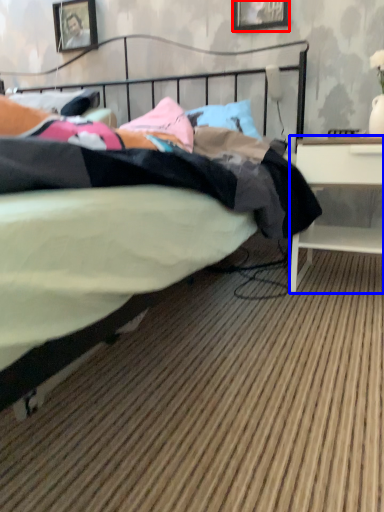
Question: Among these objects, which one is farthest to the camera, picture frame (highlighted by a red box) or desk (highlighted by a blue box)?

Choices:
 (A) picture frame
 (B) desk

Answer: (A)